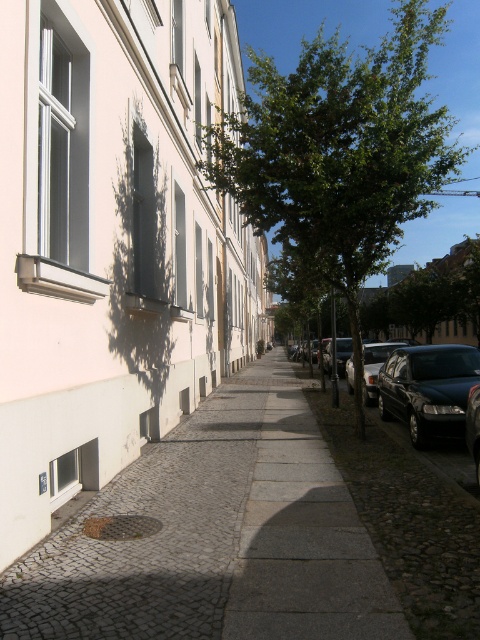
Question: Which object is farther from the camera taking this photo?

Choices:
 (A) shiny silver car at center right
 (B) green leafy tree at center

Answer: (A)

Question: Does shiny black sedan at right lie in front of shiny silver car at center?

Choices:
 (A) no
 (B) yes

Answer: (B)

Question: Estimate the real-world distances between objects in this image. Which object is farther from the shiny silver car at center right?

Choices:
 (A) white smooth building at center
 (B) shiny silver car at center
 (C) green leafy tree at center

Answer: (C)

Question: Is white smooth building at center bigger than shiny silver car at center?

Choices:
 (A) yes
 (B) no

Answer: (A)

Question: Considering the real-world distances, which object is closest to the green leafy tree at center?

Choices:
 (A) shiny black sedan at right
 (B) cobblestone pavement at lower left

Answer: (A)

Question: Does white smooth building at center appear on the right side of cobblestone pavement at lower left?

Choices:
 (A) no
 (B) yes

Answer: (A)